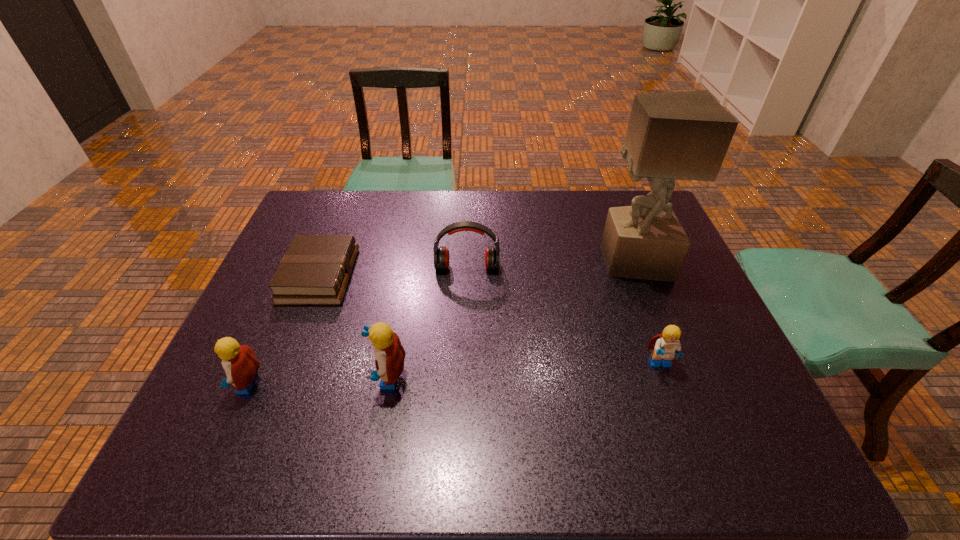
Locate an element on the screen. This screenshot has width=960, height=540. object located at the near left corner is located at coordinates (240, 364).

Locate an element on the screen. free space at the far edge is located at coordinates (361, 212).

In the image, there is a desktop. Identify the location of vacant space at the near edge. (359, 385).

Where is `free space at the left edge of the desktop`? Image resolution: width=960 pixels, height=540 pixels. free space at the left edge of the desktop is located at coordinates (279, 264).

The height and width of the screenshot is (540, 960). Find the location of `vacant space at the far left corner`. vacant space at the far left corner is located at coordinates (305, 228).

The height and width of the screenshot is (540, 960). Find the location of `free spot at the near left corner of the desktop`. free spot at the near left corner of the desktop is located at coordinates (241, 405).

The width and height of the screenshot is (960, 540). I want to click on vacant point located between the rightmost Lego and the second Lego from left to right, so click(523, 371).

I want to click on vacant region between the second Lego from right to left and the sculpture, so pos(510,319).

Locate an element on the screen. free space between the second tallest Lego and the sculpture is located at coordinates (439, 322).

I want to click on vacant point located between the fourth object from right to left and the leftmost Lego, so click(316, 381).